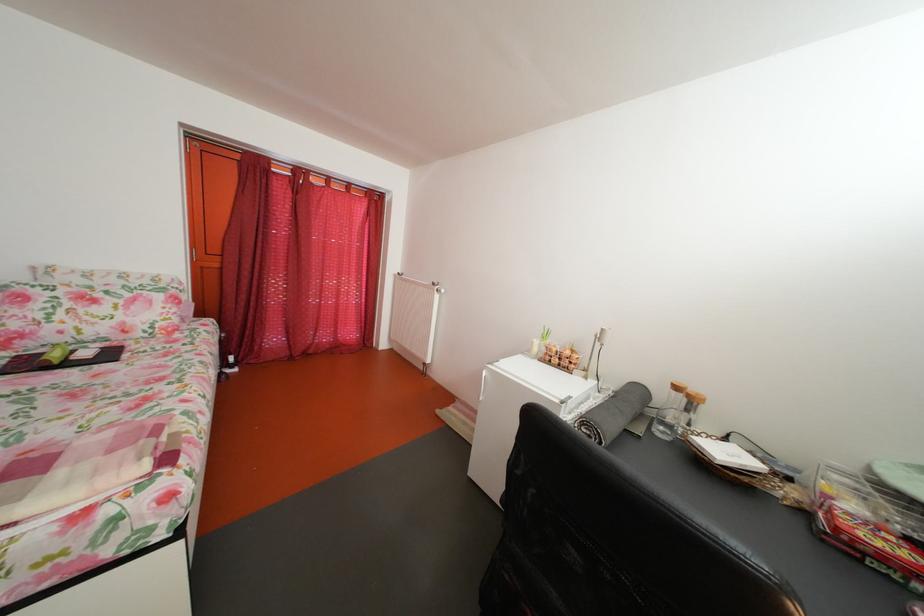
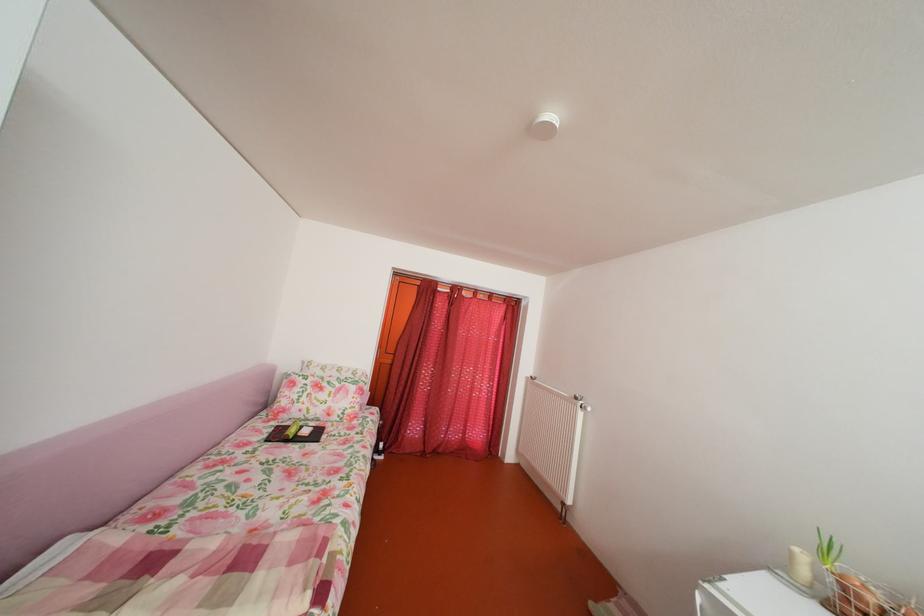
Find the pixel in the second image that matches pixel 562 357 in the first image.

(871, 605)